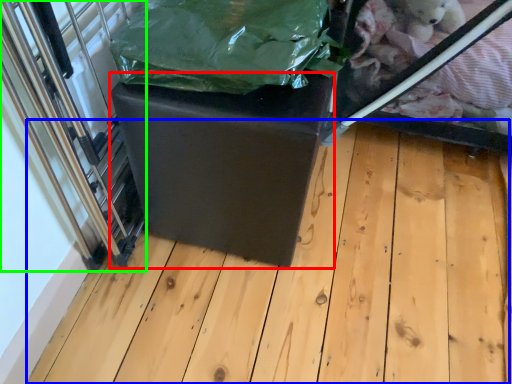
Question: Which object is positioned closest to table (highlighted by a red box)? Select from wood (highlighted by a blue box) and glass door (highlighted by a green box).

Choices:
 (A) wood
 (B) glass door

Answer: (B)